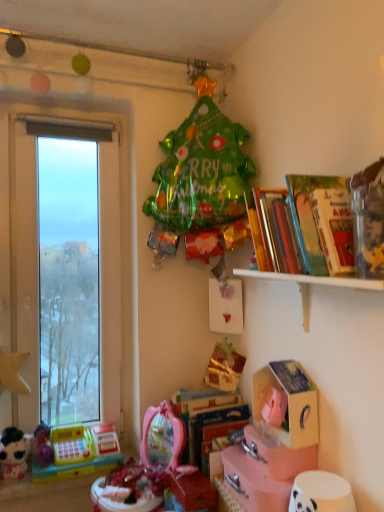
You are a GUI agent. You are given a task and a screenshot of the screen. Output one action in this format:
    pyautogui.click(x=<x>, y=<y>)
    Task: Click on the free point to the right of plush white cat at lower left, acting as the first toy starting from the left
    This screenshot has width=384, height=512.
    Given the screenshot: What is the action you would take?
    pyautogui.click(x=57, y=472)